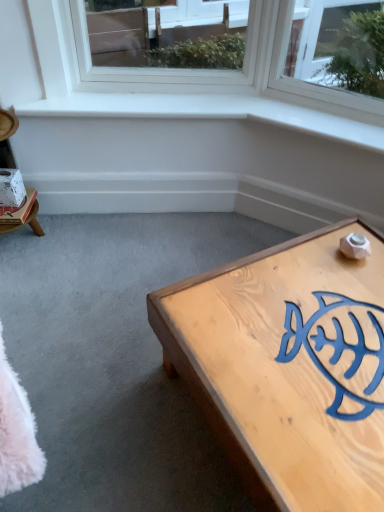
Question: From the image's perspective, is white cardboard box at left located above or below white paper at left?

Choices:
 (A) below
 (B) above

Answer: (A)

Question: From their relative heights in the image, would you say white cardboard box at left is taller or shorter than white paper at left?

Choices:
 (A) tall
 (B) short

Answer: (B)

Question: Which object is positioned closest to the white cardboard box at left?

Choices:
 (A) white paper at left
 (B) light wood coffee table at lower right

Answer: (A)

Question: Estimate the real-world distances between objects in this image. Which object is farther from the light wood coffee table at lower right?

Choices:
 (A) white cardboard box at left
 (B) white paper at left

Answer: (B)